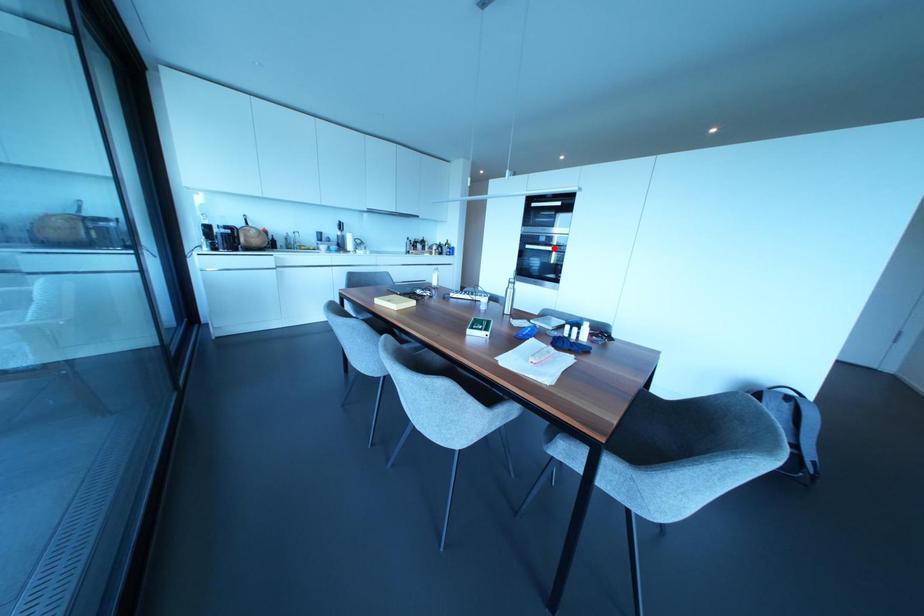
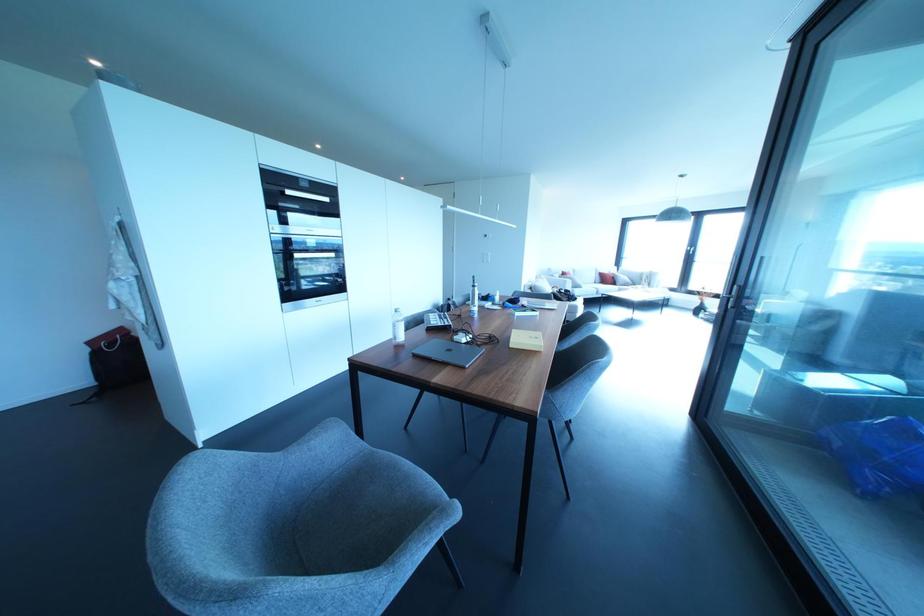
Question: I am providing you with two images of the same scene from different viewpoints. Image1 has a red point marked. In image2, the corresponding 3D location appears at what relative position? Reply with the corresponding letter.

Choices:
 (A) Closer
 (B) Farther

Answer: (B)